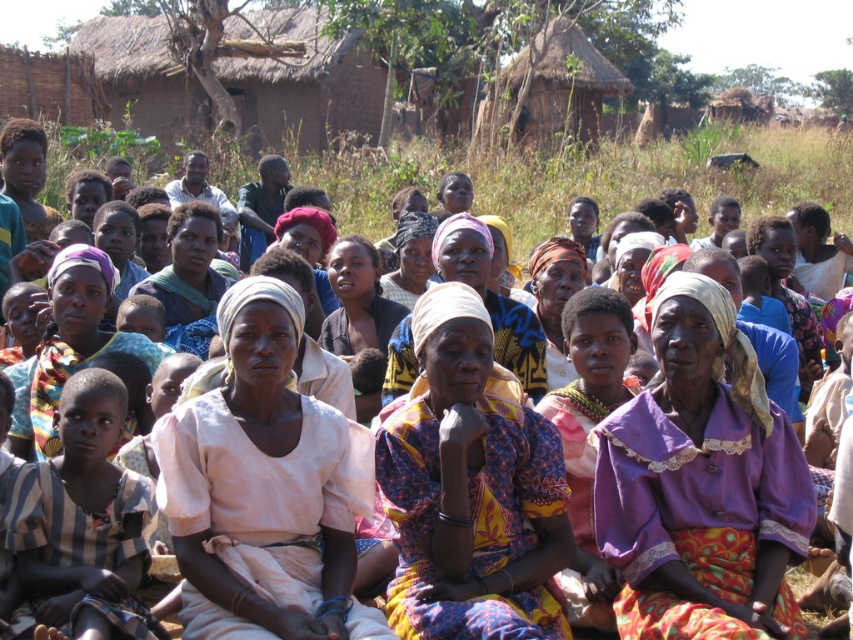
Based on the photo, you are a photographer aiming to capture the pink fabric at center and the multicolored fabric headscarf at center in a single frame. Which object should you focus on first if you want to ensure both are in focus without adjusting your camera settings?

The pink fabric at center has a greater height compared to the multicolored fabric headscarf at center, so focusing on the pink fabric at center first will help ensure both are in focus since it is taller and likely farther away.

You are a photographer trying to capture a closeup of the purple fabric at center and the purple fabric headscarf at center in the scene. Given that your camera has a maximum focus range of 20 feet, will you be able to focus on both objects simultaneously?

The distance between the purple fabric at center and the purple fabric headscarf at center is 20.81 feet, which exceeds the camera maximum focus range of 20 feet. Therefore, the camera cannot focus on both objects simultaneously.